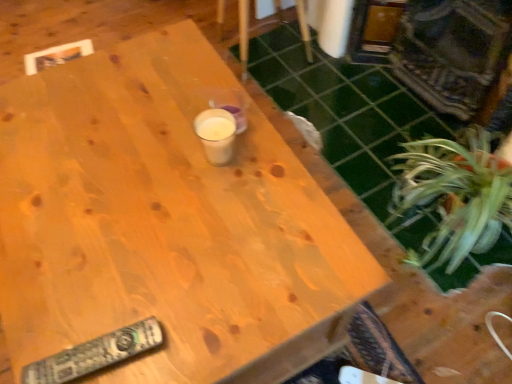
Question: Are green leafy plant at lower right and wooden table at center far apart?

Choices:
 (A) no
 (B) yes

Answer: (A)

Question: Is green leafy plant at lower right thinner than wooden table at center?

Choices:
 (A) yes
 (B) no

Answer: (A)

Question: Does green leafy plant at lower right have a lesser height compared to wooden table at center?

Choices:
 (A) no
 (B) yes

Answer: (B)

Question: Is green leafy plant at lower right facing towards wooden table at center?

Choices:
 (A) no
 (B) yes

Answer: (B)

Question: Is green leafy plant at lower right next to wooden table at center and touching it?

Choices:
 (A) no
 (B) yes

Answer: (A)

Question: Would you say wooden table at center is part of green leafy plant at lower right's contents?

Choices:
 (A) yes
 (B) no

Answer: (B)

Question: From a real-world perspective, is wooden table at center physically above green leafy plant at lower right?

Choices:
 (A) no
 (B) yes

Answer: (B)

Question: Does wooden table at center have a greater width compared to green leafy plant at lower right?

Choices:
 (A) no
 (B) yes

Answer: (B)

Question: Considering the relative sizes of wooden table at center and green leafy plant at lower right in the image provided, is wooden table at center shorter than green leafy plant at lower right?

Choices:
 (A) no
 (B) yes

Answer: (A)

Question: Is wooden table at center smaller than green leafy plant at lower right?

Choices:
 (A) yes
 (B) no

Answer: (B)

Question: Can we say wooden table at center lies outside green leafy plant at lower right?

Choices:
 (A) no
 (B) yes

Answer: (B)

Question: From the image's perspective, is wooden table at center below green leafy plant at lower right?

Choices:
 (A) no
 (B) yes

Answer: (B)

Question: Is wooden chair at upper center at the back of green leafy plant at lower right?

Choices:
 (A) yes
 (B) no

Answer: (B)